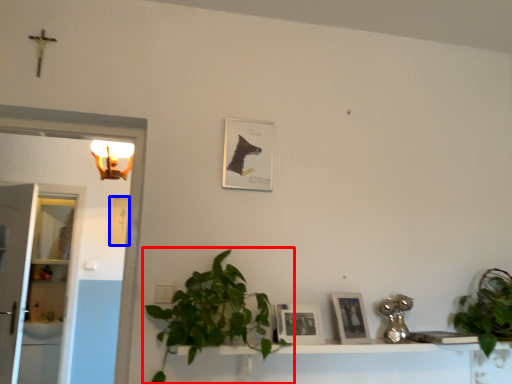
Question: Which point is closer to the camera, houseplant (highlighted by a red box) or picture frame (highlighted by a blue box)?

Choices:
 (A) houseplant
 (B) picture frame

Answer: (A)